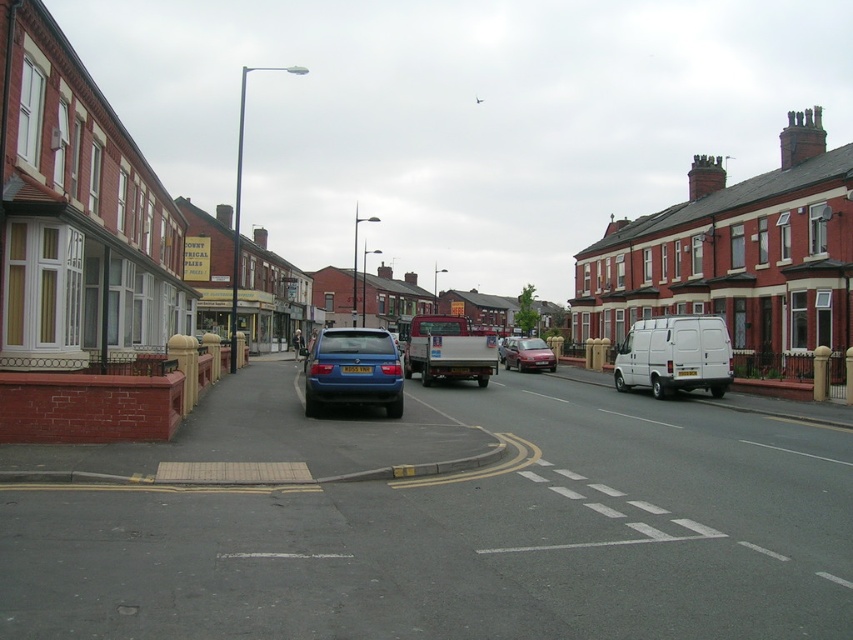
Question: Is matte white truck at center thinner than yellow matte license plate at center?

Choices:
 (A) no
 (B) yes

Answer: (A)

Question: Can you confirm if white matte van at center-right is smaller than yellow matte license plate at center?

Choices:
 (A) yes
 (B) no

Answer: (B)

Question: Which object is closer to the camera taking this photo?

Choices:
 (A) yellow matte license plate at center
 (B) white matte van at center-right
 (C) matte white truck at center
 (D) metallic red sedan at center

Answer: (A)

Question: Does matte blue hatchback at center have a lesser width compared to matte white truck at center?

Choices:
 (A) yes
 (B) no

Answer: (B)

Question: Which object is farther from the camera taking this photo?

Choices:
 (A) metallic red sedan at center
 (B) white matte van at center-right
 (C) matte white truck at center

Answer: (A)

Question: Considering the real-world distances, which object is closest to the white matte van at center-right?

Choices:
 (A) yellow matte license plate at center
 (B) metallic red sedan at center
 (C) matte white truck at center
 (D) matte blue hatchback at center

Answer: (C)